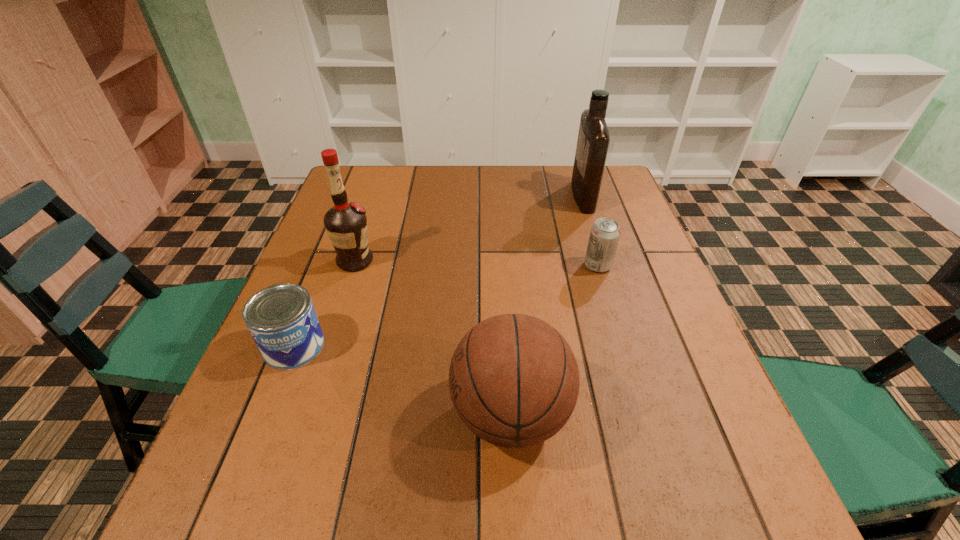
The image size is (960, 540). What are the coordinates of `the farther liquor` in the screenshot? It's located at (593, 140).

Locate an element on the screen. This screenshot has width=960, height=540. the farthest object is located at coordinates [593, 140].

Locate an element on the screen. the nearer liquor is located at coordinates (346, 224).

I want to click on the third shortest object, so click(x=514, y=382).

At what (x,y) coordinates should I click in order to perform the action: click on the third object from left to right. Please return your answer as a coordinate pair (x, y). Looking at the image, I should click on (514, 382).

Where is `soda can`? Image resolution: width=960 pixels, height=540 pixels. soda can is located at coordinates (605, 232).

This screenshot has height=540, width=960. Find the location of `can`. can is located at coordinates (282, 320).

This screenshot has width=960, height=540. Identify the location of vacant area situated 0.130m on the label side of the farthest object. coord(531,197).

Locate an element on the screen. The height and width of the screenshot is (540, 960). vacant space located 0.340m on the label side of the farthest object is located at coordinates (463, 197).

Locate an element on the screen. vacant region located on the label side of the farthest object is located at coordinates (459, 197).